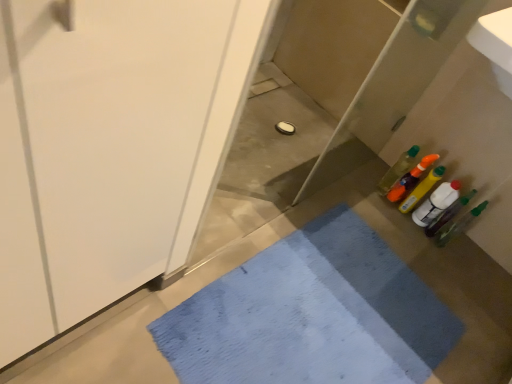
Question: Should I look upward or downward to see blue woven bath mat at lower center?

Choices:
 (A) down
 (B) up

Answer: (A)

Question: From a real-world perspective, is translucent plastic bottle at right, the 1th bottle from the right, located beneath translucent plastic bottle at right, the fourth bottle viewed from the right?

Choices:
 (A) no
 (B) yes

Answer: (A)

Question: Is translucent plastic bottle at right, the 1th bottle from the right, in contact with translucent plastic bottle at right, the third bottle from the left?

Choices:
 (A) yes
 (B) no

Answer: (B)

Question: Is translucent plastic bottle at right, the 1th bottle from the right, taller than translucent plastic bottle at right, the third bottle from the left?

Choices:
 (A) yes
 (B) no

Answer: (B)

Question: From a real-world perspective, is translucent plastic bottle at right, the 1th bottle from the right, on translucent plastic bottle at right, the fourth bottle viewed from the right?

Choices:
 (A) no
 (B) yes

Answer: (B)

Question: Can you confirm if translucent plastic bottle at right, marked as the sixth bottle in a left-to-right arrangement, is thinner than translucent plastic bottle at right, the fourth bottle viewed from the right?

Choices:
 (A) yes
 (B) no

Answer: (A)

Question: Is translucent plastic bottle at right, the 1th bottle from the right, at the right side of translucent plastic bottle at right, the third bottle from the left?

Choices:
 (A) no
 (B) yes

Answer: (B)

Question: Does translucent plastic bottle at right, marked as the sixth bottle in a left-to-right arrangement, have a smaller size compared to translucent plastic bottle at right, which ranks as the fifth bottle in left-to-right order?

Choices:
 (A) no
 (B) yes

Answer: (A)

Question: Is translucent plastic bottle at right, the 1th bottle from the right, outside translucent plastic bottle at right, which ranks as the fifth bottle in left-to-right order?

Choices:
 (A) no
 (B) yes

Answer: (B)

Question: Is translucent plastic bottle at right, marked as the sixth bottle in a left-to-right arrangement, positioned in front of translucent plastic bottle at right, the second bottle when ordered from right to left?

Choices:
 (A) no
 (B) yes

Answer: (B)

Question: Are translucent plastic bottle at right, marked as the sixth bottle in a left-to-right arrangement, and translucent plastic bottle at right, which ranks as the fifth bottle in left-to-right order, beside each other?

Choices:
 (A) no
 (B) yes

Answer: (B)

Question: From the image's perspective, is translucent plastic bottle at right, marked as the sixth bottle in a left-to-right arrangement, below translucent plastic bottle at right, which ranks as the fifth bottle in left-to-right order?

Choices:
 (A) yes
 (B) no

Answer: (A)

Question: Is translucent plastic bottle at right, the 1th bottle from the right, behind translucent plastic bottle at right, which ranks as the fifth bottle in left-to-right order?

Choices:
 (A) yes
 (B) no

Answer: (B)

Question: Is translucent plastic bottles at right, which is the sixth bottle from right to left, wider than translucent plastic bottle at right, the third bottle from the left?

Choices:
 (A) no
 (B) yes

Answer: (A)